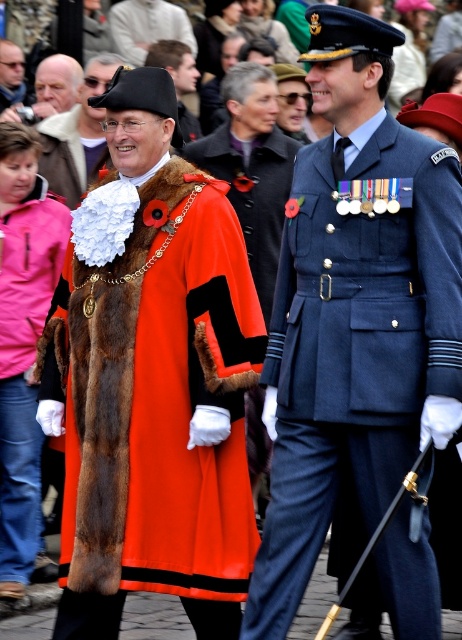
Can you confirm if matte black uniform at center is positioned above brown fur coat at center?

Correct, matte black uniform at center is located above brown fur coat at center.

Can you confirm if matte black uniform at center is positioned below brown fur coat at center?

Actually, matte black uniform at center is above brown fur coat at center.

Does point (430, 262) come in front of point (190, 547)?

Yes, point (430, 262) is in front of point (190, 547).

This screenshot has height=640, width=462. In order to click on matte black uniform at center in this screenshot , I will do `click(354, 310)`.

Does matte black uniform at center appear over velvet black hat at center?

No, matte black uniform at center is not above velvet black hat at center.

Does matte black uniform at center appear on the left side of velvet black hat at center?

Incorrect, matte black uniform at center is not on the left side of velvet black hat at center.

The image size is (462, 640). What do you see at coordinates (354, 310) in the screenshot? I see `matte black uniform at center` at bounding box center [354, 310].

Locate an element on the screen. matte black uniform at center is located at coordinates (354, 310).

Who is taller, brown fur coat at center or velvet red cape at center?

brown fur coat at center is taller.

Does brown fur coat at center have a greater height compared to velvet red cape at center?

Yes.

What do you see at coordinates (157, 397) in the screenshot? I see `brown fur coat at center` at bounding box center [157, 397].

Locate an element on the screen. The height and width of the screenshot is (640, 462). brown fur coat at center is located at coordinates (157, 397).